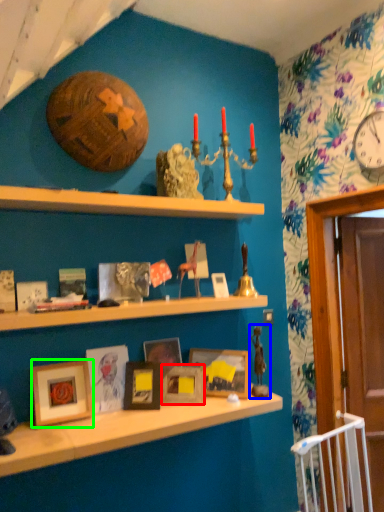
Question: Considering the real-world distances, which object is closest to picture frame (highlighted by a red box)? toy (highlighted by a blue box) or picture frame (highlighted by a green box).

Choices:
 (A) toy
 (B) picture frame

Answer: (A)